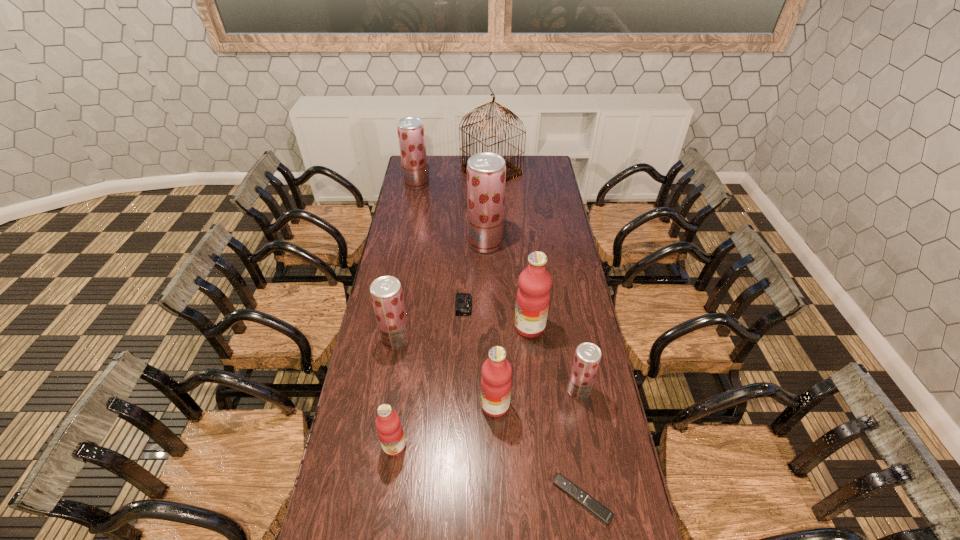
Find the location of a particular element. The width and height of the screenshot is (960, 540). birdcage is located at coordinates (512, 171).

You are a GUI agent. You are given a task and a screenshot of the screen. Output one action in this format:
    pyautogui.click(x=<x>, y=<y>)
    Task: Click on the sixth nearest fruit juice
    This screenshot has width=960, height=540.
    Given the screenshot: What is the action you would take?
    pyautogui.click(x=486, y=172)

Find the location of a particular element. the eighth nearest object is located at coordinates (486, 172).

Locate an element on the screen. The width and height of the screenshot is (960, 540). the second biggest strawberry fruit juice is located at coordinates (411, 136).

Locate an element on the screen. the farthest fruit juice is located at coordinates (411, 136).

Locate an element on the screen. This screenshot has width=960, height=540. the rightmost pink fruit juice is located at coordinates (533, 296).

I want to click on the biggest pink fruit juice, so click(533, 296).

Identify the location of the second nearest strawberry fruit juice. (386, 292).

Where is `the second smallest pink fruit juice`? This screenshot has height=540, width=960. the second smallest pink fruit juice is located at coordinates click(496, 382).

The image size is (960, 540). I want to click on the second nearest pink fruit juice, so click(496, 382).